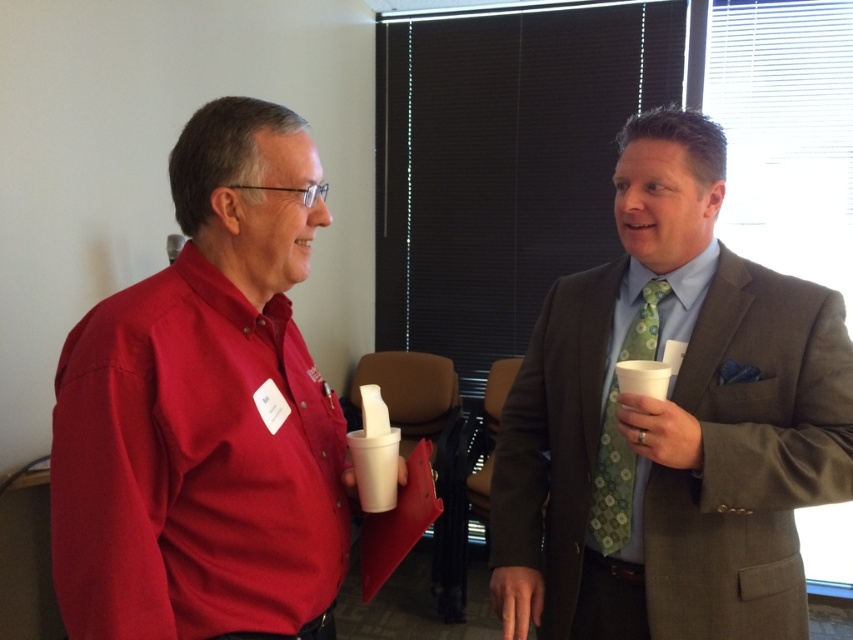
Question: Which point appears closest to the camera in this image?

Choices:
 (A) (618, 420)
 (B) (262, 342)
 (C) (654, 300)

Answer: (B)

Question: Is green textured tie at right positioned before green floral tie at right?

Choices:
 (A) yes
 (B) no

Answer: (A)

Question: Does green textured tie at right have a larger size compared to green floral tie at right?

Choices:
 (A) no
 (B) yes

Answer: (B)

Question: Observing the image, what is the correct spatial positioning of matte red shirt at left in reference to green floral tie at right?

Choices:
 (A) above
 (B) below

Answer: (A)

Question: Estimate the real-world distances between objects in this image. Which object is farther from the green floral tie at right?

Choices:
 (A) green textured tie at right
 (B) matte red shirt at left

Answer: (B)

Question: Which object appears closest to the camera in this image?

Choices:
 (A) matte red shirt at left
 (B) green floral tie at right

Answer: (A)